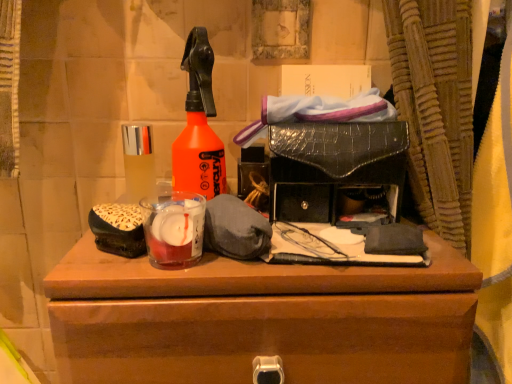
Question: Is brown wooden chest of drawers at center beside translucent glass bottle at center left?

Choices:
 (A) no
 (B) yes

Answer: (A)

Question: Is brown wooden chest of drawers at center positioned in front of translucent glass bottle at center left?

Choices:
 (A) yes
 (B) no

Answer: (A)

Question: Does brown wooden chest of drawers at center have a lesser height compared to translucent glass bottle at center left?

Choices:
 (A) no
 (B) yes

Answer: (A)

Question: From a real-world perspective, is brown wooden chest of drawers at center positioned under translucent glass bottle at center left based on gravity?

Choices:
 (A) no
 (B) yes

Answer: (B)

Question: Is brown wooden chest of drawers at center thinner than translucent glass bottle at center left?

Choices:
 (A) no
 (B) yes

Answer: (A)

Question: Choose the correct answer: Is translucent glass bottle at center left inside brown wooden chest of drawers at center or outside it?

Choices:
 (A) inside
 (B) outside

Answer: (B)

Question: Does point (125, 124) appear closer or farther from the camera than point (475, 284)?

Choices:
 (A) farther
 (B) closer

Answer: (A)

Question: From the image's perspective, is translucent glass bottle at center left above or below brown wooden chest of drawers at center?

Choices:
 (A) above
 (B) below

Answer: (A)

Question: Considering the positions of translucent glass bottle at center left and brown wooden chest of drawers at center in the image, is translucent glass bottle at center left bigger or smaller than brown wooden chest of drawers at center?

Choices:
 (A) small
 (B) big

Answer: (A)

Question: Is brown wooden chest of drawers at center in front of or behind translucent glass candle at center in the image?

Choices:
 (A) behind
 (B) front

Answer: (B)

Question: From the image's perspective, is brown wooden chest of drawers at center located above or below translucent glass candle at center?

Choices:
 (A) above
 (B) below

Answer: (B)

Question: From a real-world perspective, is brown wooden chest of drawers at center physically located above or below translucent glass candle at center?

Choices:
 (A) above
 (B) below

Answer: (B)

Question: Considering the positions of brown wooden chest of drawers at center and translucent glass candle at center in the image, is brown wooden chest of drawers at center taller or shorter than translucent glass candle at center?

Choices:
 (A) short
 (B) tall

Answer: (B)

Question: Considering the positions of translucent glass candle at center and translucent glass bottle at center left in the image, is translucent glass candle at center wider or thinner than translucent glass bottle at center left?

Choices:
 (A) thin
 (B) wide

Answer: (B)

Question: From their relative heights in the image, would you say translucent glass candle at center is taller or shorter than translucent glass bottle at center left?

Choices:
 (A) tall
 (B) short

Answer: (B)